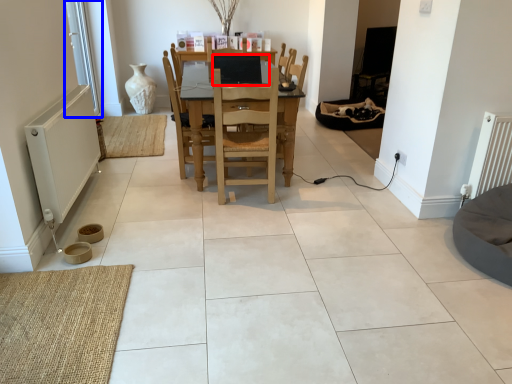
Question: Which of the following is the farthest to the observer, computer (highlighted by a red box) or window screen (highlighted by a blue box)?

Choices:
 (A) computer
 (B) window screen

Answer: (B)